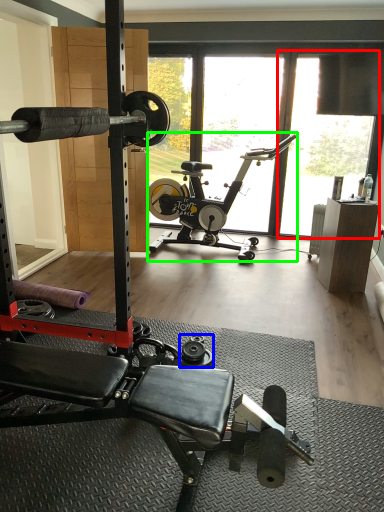
Question: Estimate the real-world distances between objects in this image. Which object is farther from window screen (highlighted by a red box), dumbbell (highlighted by a blue box) or stationary bicycle (highlighted by a green box)?

Choices:
 (A) dumbbell
 (B) stationary bicycle

Answer: (A)